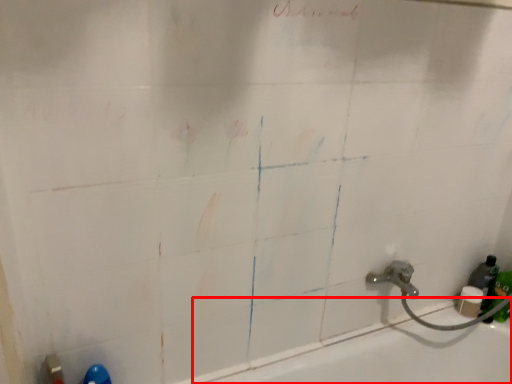
Question: Observing the image, what is the correct spatial positioning of bath (annotated by the red box) in reference to bottle?

Choices:
 (A) right
 (B) left

Answer: (B)